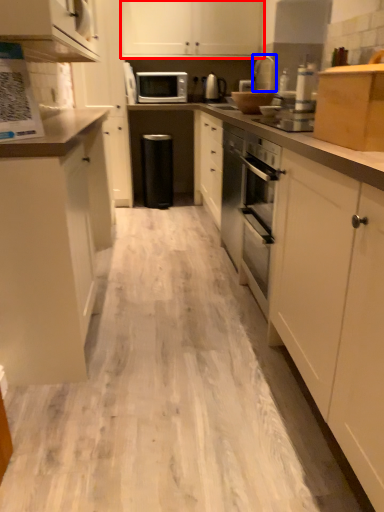
Question: Which object appears farthest to the camera in this image, cabinetry (highlighted by a red box) or appliance (highlighted by a blue box)?

Choices:
 (A) cabinetry
 (B) appliance

Answer: (A)